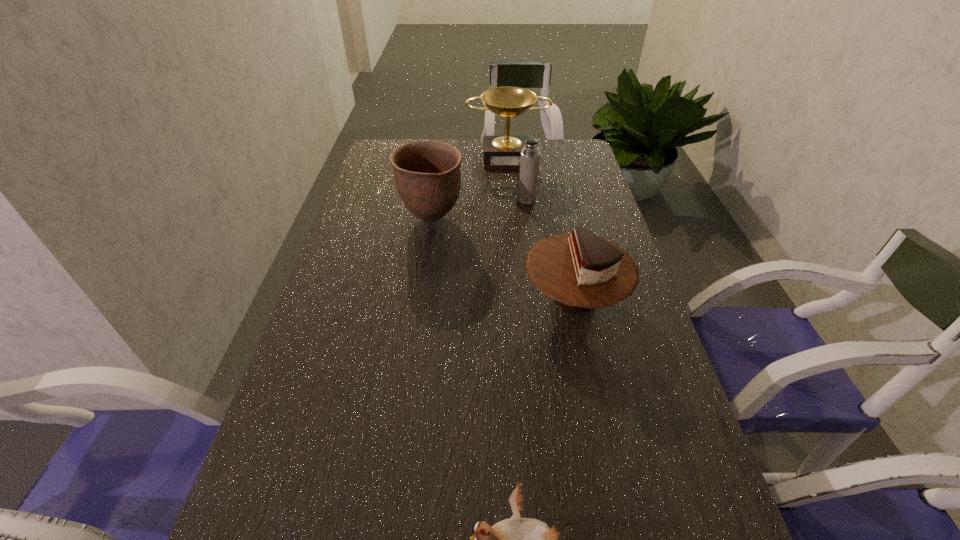
The image size is (960, 540). What are the coordinates of `vacant space in between the farthest object and the pottery` in the screenshot? It's located at (469, 187).

Point out which object is positioned as the third nearest to the cake. Please provide its 2D coordinates. Your answer should be formatted as a tuple, i.e. [(x, y)], where the tuple contains the x and y coordinates of a point satisfying the conditions above.

[(517, 539)]

Identify which object is the third closest to the bird. Please provide its 2D coordinates. Your answer should be formatted as a tuple, i.e. [(x, y)], where the tuple contains the x and y coordinates of a point satisfying the conditions above.

[(530, 156)]

Locate an element on the screen. The height and width of the screenshot is (540, 960). free space that satisfies the following two spatial constraints: 1. on the front-facing side of the farthest object; 2. on the right side of the second nearest object is located at coordinates (519, 297).

Locate an element on the screen. This screenshot has width=960, height=540. vacant position in the image that satisfies the following two spatial constraints: 1. on the front side of the fourth farthest object; 2. on the left side of the thermos bottle is located at coordinates (540, 297).

The height and width of the screenshot is (540, 960). I want to click on blank area in the image that satisfies the following two spatial constraints: 1. on the front-facing side of the fourth farthest object; 2. on the left side of the award, so click(519, 297).